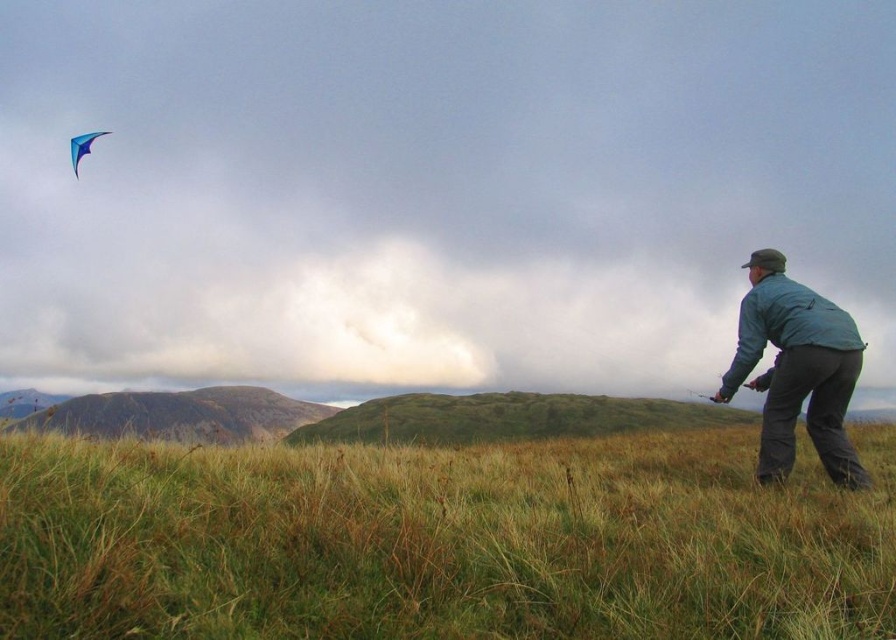
You are standing in the middle of the green grassy field at lower right and want to walk towards the blue glossy kite at upper left. Which direction should you head?

You should head towards the upper left direction because the blue glossy kite at upper left is further away from you compared to the green grassy field at lower right which you are currently standing on.

You are standing at the point labeled point [442,541] in the image. Based on the scene description, what is the immediate surface you are standing on?

The immediate surface you are standing on is the green grassy field at lower right as indicated by the point [442,541].